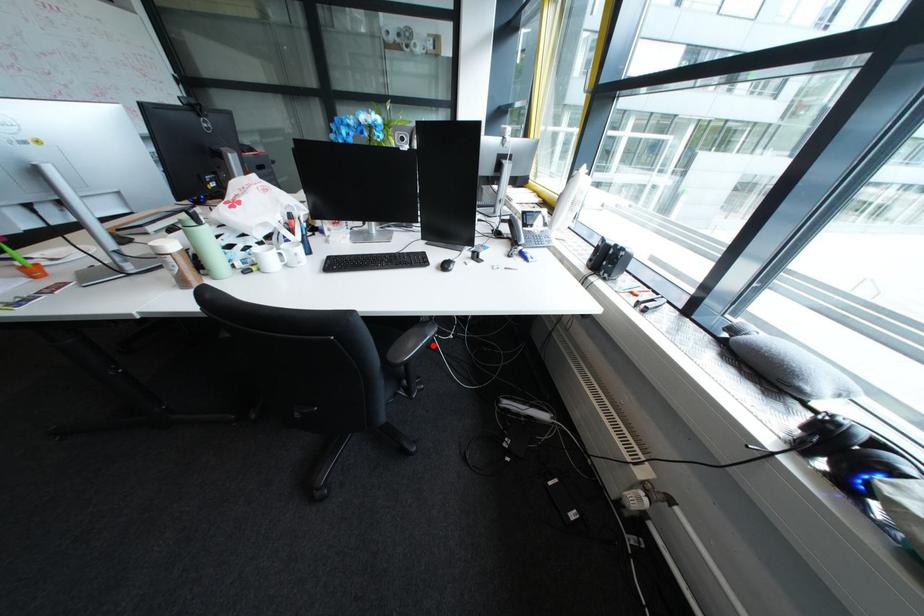
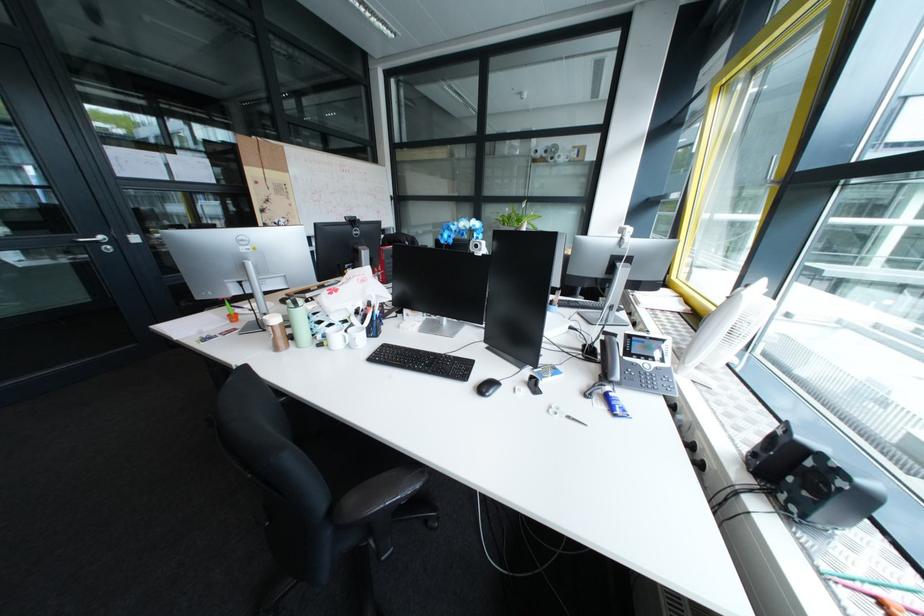
Question: A red point is marked in image1. In image2, is the corresponding 3D point closer to the camera or farther? Reply with the corresponding letter.

Choices:
 (A) The corresponding 3D point is closer.
 (B) The corresponding 3D point is farther.

Answer: (B)